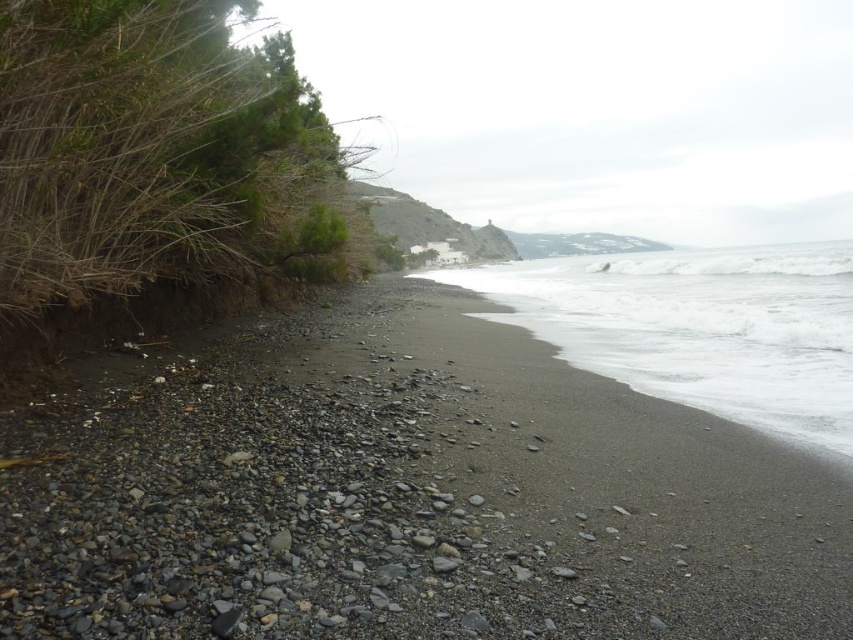
You are a hiker who wants to cross from the smooth pebbles at lower left to the white foamy water at lower right. The path you need to take is directly between them. Your backpack has a weight limit of 20 kilograms. If each meter you walk adds 0.5 kilograms to your backpack due to the terrain, will you be able to make the crossing without exceeding your backpack weight limit?

The distance between the smooth pebbles at lower left and the white foamy water at lower right is 26.65 meters. Each meter adds 0.5 kg, so 26.65 meters would add 13.325 kg. Since the backpack limit is 20 kg, you can safely make the crossing as 13.325 kg is below the limit.

You are standing at the center of the beach in the image. Looking towards the dense vegetation on the left, can you see the smooth pebbles at lower left marked by point (404, 493)?

Yes, the point (404, 493) marks smooth pebbles at lower left, which are visible from the center of the beach as they are located in the foreground near the dense vegetation on the left.

You are standing on the beach and want to place a 1.2 meter long wooden board between the smooth pebbles at lower left and the white foamy water at lower right. Can the board fit horizontally between them?

The smooth pebbles at lower left is narrower than the white foamy water at lower right. Since the board is 1.2 meters long, it depends on the actual distance between them. However, the description only states the width of the pebbles is less than the water, not the distance between them. Therefore, we cannot determine if the board will fit based on the given information.